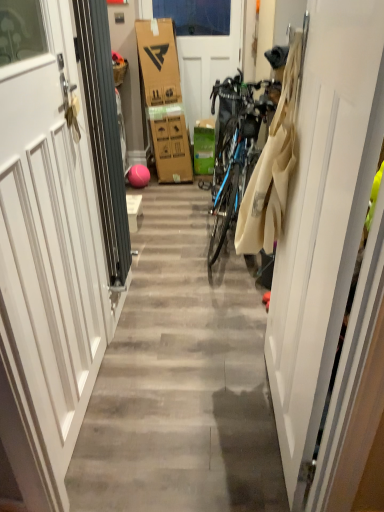
What is the approximate height of green cardboard box at center?

The height of green cardboard box at center is 50.36 centimeters.

The width and height of the screenshot is (384, 512). Describe the element at coordinates (204, 146) in the screenshot. I see `green cardboard box at center` at that location.

Locate an element on the screen. Image resolution: width=384 pixels, height=512 pixels. white matte door at left, which is the first door from left to right is located at coordinates (46, 254).

Is point (209, 145) positioned before point (355, 182)?

No, (209, 145) is further to viewer.

From the image's perspective, is green cardboard box at center located above white matte door at center, the 3th door viewed from the back?

Yes, from the image's perspective, green cardboard box at center is on top of white matte door at center, the 3th door viewed from the back.

Which object is further away from the camera, green cardboard box at center or white matte door at center, which is the first door from front to back?

Positioned behind is green cardboard box at center.

Considering the sizes of objects green cardboard box at center and white matte door at center, which is the first door from front to back, in the image provided, who is wider, green cardboard box at center or white matte door at center, which is the first door from front to back,?

green cardboard box at center is wider.

Between green cardboard box at center and white matte door at center, marked as the 3th door in a front-to-back arrangement, which one is positioned behind?

green cardboard box at center.

Does point (205, 162) come behind point (198, 67)?

Yes, point (205, 162) is farther from viewer.

From a real-world perspective, is green cardboard box at center on top of white matte door at center, which is counted as the first door, starting from the back?

Incorrect, from a real-world perspective, green cardboard box at center is lower than white matte door at center, which is counted as the first door, starting from the back.

Is white matte door at center, which is counted as the first door, starting from the back, next to beige cotton laundry at right and touching it?

There is a gap between white matte door at center, which is counted as the first door, starting from the back, and beige cotton laundry at right.

Does white matte door at center, positioned as the second door in left-to-right order, have a lesser width compared to beige cotton laundry at right?

Indeed, white matte door at center, positioned as the second door in left-to-right order, has a lesser width compared to beige cotton laundry at right.

Measure the distance from white matte door at center, marked as the 3th door in a front-to-back arrangement, to beige cotton laundry at right.

white matte door at center, marked as the 3th door in a front-to-back arrangement, and beige cotton laundry at right are 2.72 meters apart.

Considering the relative positions of white matte door at center, positioned as the second door in left-to-right order, and beige cotton laundry at right in the image provided, is white matte door at center, positioned as the second door in left-to-right order, in front of beige cotton laundry at right?

No, white matte door at center, positioned as the second door in left-to-right order, is behind beige cotton laundry at right.

I want to click on door in front of the white matte door at left, which is the second door in front-to-back order, so click(323, 217).

Consider the image. Which object is more forward, white matte door at center, which is the first door from front to back, or white matte door at left, which is the first door from left to right?

Positioned in front is white matte door at center, which is the first door from front to back.

Is white matte door at center, the first door viewed from the right, not inside white matte door at left, which ranks as the second door in back-to-front order?

Yes, white matte door at center, the first door viewed from the right, is outside of white matte door at left, which ranks as the second door in back-to-front order.

Does point (365, 110) lie behind point (19, 137)?

No, it is in front of (19, 137).

Is beige cotton laundry at right taller or shorter than green cardboard box at center?

Clearly, beige cotton laundry at right is taller compared to green cardboard box at center.

Does beige cotton laundry at right appear on the right side of green cardboard box at center?

Yes, beige cotton laundry at right is to the right of green cardboard box at center.

In the scene shown: How much distance is there between beige cotton laundry at right and green cardboard box at center?

A distance of 8.30 feet exists between beige cotton laundry at right and green cardboard box at center.

From the image's perspective, is beige cotton laundry at right on green cardboard box at center?

Incorrect, from the image's perspective, beige cotton laundry at right is lower than green cardboard box at center.

From a real-world perspective, which object rests below the other?

white matte door at left, which is the second door in front-to-back order, from a real-world perspective.

Is point (86, 177) farther from camera compared to point (195, 70)?

No.

Is white matte door at left, marked as the 3th door in a right-to-left arrangement, in front of or behind white matte door at center, marked as the 3th door in a front-to-back arrangement, in the image?

Clearly, white matte door at left, marked as the 3th door in a right-to-left arrangement, is in front of white matte door at center, marked as the 3th door in a front-to-back arrangement.

Looking at this image, measure the distance between white matte door at left, which is the first door from left to right, and green cardboard box at center.

The distance of white matte door at left, which is the first door from left to right, from green cardboard box at center is 8.84 feet.

Can green cardboard box at center be found inside white matte door at left, which is the first door from left to right?

No, green cardboard box at center is not a part of white matte door at left, which is the first door from left to right.

Is white matte door at left, which ranks as the second door in back-to-front order, looking in the opposite direction of green cardboard box at center?

No, white matte door at left, which ranks as the second door in back-to-front order, is not facing away from green cardboard box at center.

Which is behind, point (81, 374) or point (201, 128)?

The point (201, 128) is farther.

Find the location of `door that is the 2nd one above the green cardboard box at center (from a real-world perspective)`. door that is the 2nd one above the green cardboard box at center (from a real-world perspective) is located at coordinates (323, 217).

The height and width of the screenshot is (512, 384). I want to click on the 1st door in front when counting from the green cardboard box at center, so click(208, 63).

From the picture: Based on their spatial positions, is white matte door at center, marked as the 3th door in a front-to-back arrangement, or beige cotton laundry at right closer to white matte door at left, which is the second door in front-to-back order?

Among the two, beige cotton laundry at right is located nearer to white matte door at left, which is the second door in front-to-back order.

Which object lies further to the anchor point white matte door at left, which ranks as the second door in back-to-front order, white matte door at center, marked as the 3th door in a front-to-back arrangement, or white matte door at center, the first door viewed from the right?

white matte door at center, marked as the 3th door in a front-to-back arrangement, lies further to white matte door at left, which ranks as the second door in back-to-front order, than the other object.

Which object lies further to the anchor point green cardboard box at center, beige cotton laundry at right or white matte door at center, the 3th door viewed from the back?

Based on the image, white matte door at center, the 3th door viewed from the back, appears to be further to green cardboard box at center.

Based on their spatial positions, is white matte door at left, which ranks as the second door in back-to-front order, or beige cotton laundry at right further from white matte door at center, the 3th door viewed from the back?

Based on the image, white matte door at left, which ranks as the second door in back-to-front order, appears to be further to white matte door at center, the 3th door viewed from the back.

When comparing their distances from beige cotton laundry at right, does white matte door at left, which ranks as the second door in back-to-front order, or white matte door at center, marked as the 3th door in a front-to-back arrangement, seem closer?

white matte door at left, which ranks as the second door in back-to-front order.

When comparing their distances from white matte door at center, marked as the 3th door in a front-to-back arrangement, does beige cotton laundry at right or white matte door at center, which is the first door from front to back, seem further?

Based on the image, white matte door at center, which is the first door from front to back, appears to be further to white matte door at center, marked as the 3th door in a front-to-back arrangement.

Considering their positions, is white matte door at left, which ranks as the second door in back-to-front order, positioned closer to white matte door at center, which is the third door from left to right, than green cardboard box at center?

The object closer to white matte door at center, which is the third door from left to right, is white matte door at left, which ranks as the second door in back-to-front order.

Looking at the image, which one is located further to beige cotton laundry at right, white matte door at left, which ranks as the second door in back-to-front order, or green cardboard box at center?

green cardboard box at center is further to beige cotton laundry at right.

Where is `laundry situated between white matte door at left, which is the first door from left to right, and white matte door at center, which is the first door from front to back, from left to right`? laundry situated between white matte door at left, which is the first door from left to right, and white matte door at center, which is the first door from front to back, from left to right is located at coordinates (272, 167).

Identify the location of laundry between white matte door at left, which is the second door in front-to-back order, and white matte door at center, positioned as the second door in left-to-right order, in the front-back direction. The image size is (384, 512). (272, 167).

Image resolution: width=384 pixels, height=512 pixels. In order to click on door between beige cotton laundry at right and green cardboard box at center along the z-axis in this screenshot , I will do `click(208, 63)`.

The width and height of the screenshot is (384, 512). Identify the location of door positioned between white matte door at center, which is the third door from left to right, and white matte door at center, the 2th door from the right, from near to far. (46, 254).